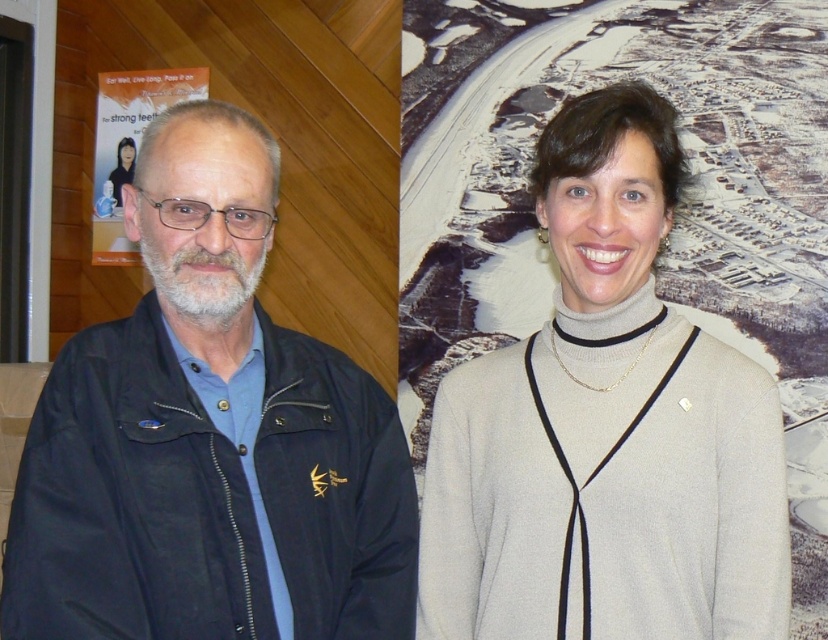
Does matte paper poster at upper left lie in front of smooth black hair at upper left?

No, matte paper poster at upper left is behind smooth black hair at upper left.

The width and height of the screenshot is (828, 640). Describe the element at coordinates (128, 145) in the screenshot. I see `matte paper poster at upper left` at that location.

Image resolution: width=828 pixels, height=640 pixels. I want to click on matte paper poster at upper left, so click(128, 145).

Where is `black matte jacket at left`? Image resolution: width=828 pixels, height=640 pixels. black matte jacket at left is located at coordinates (208, 436).

Who is positioned more to the right, black matte jacket at left or light gray sweater at center?

light gray sweater at center

This screenshot has width=828, height=640. In order to click on black matte jacket at left in this screenshot , I will do `click(208, 436)`.

Between light gray sweater at center and matte paper poster at upper left, which one has more height?

Standing taller between the two is light gray sweater at center.

Who is more distant from viewer, (639, 284) or (100, 168)?

The point (100, 168) is more distant.

Is point (621, 225) positioned after point (118, 141)?

No, it is not.

Locate an element on the screen. Image resolution: width=828 pixels, height=640 pixels. light gray sweater at center is located at coordinates (605, 429).